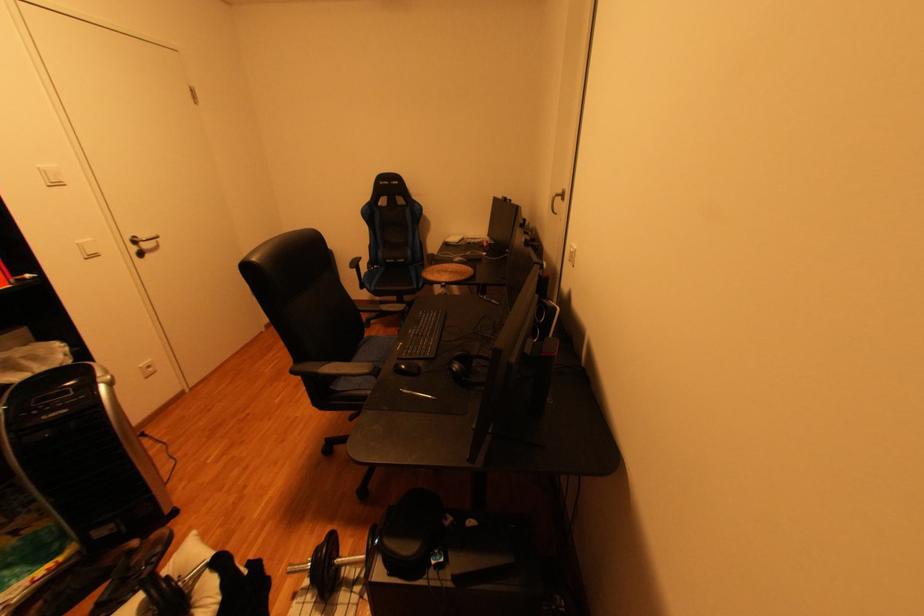
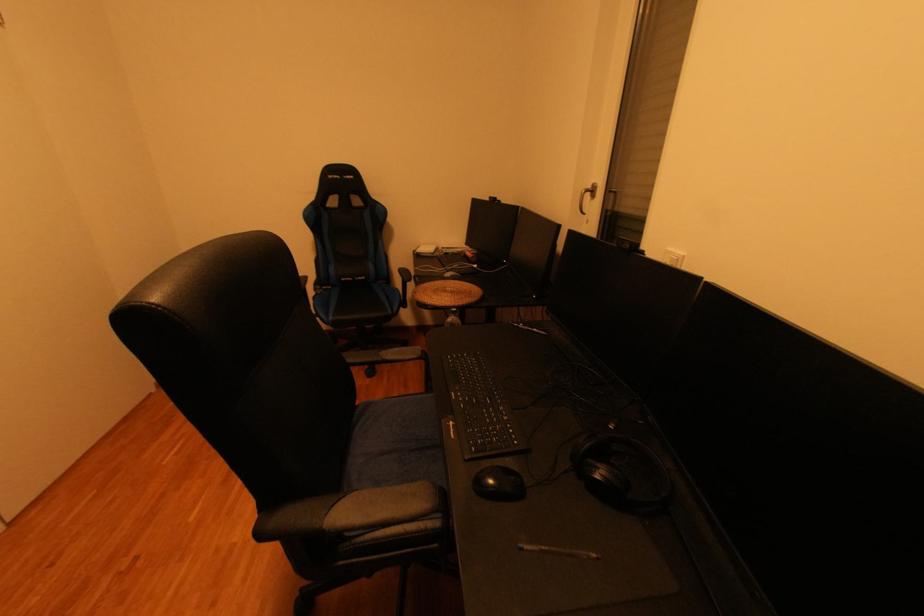
The images are taken continuously from a first-person perspective. In which direction are you moving?

The movement direction of the cameraman is left, forward.